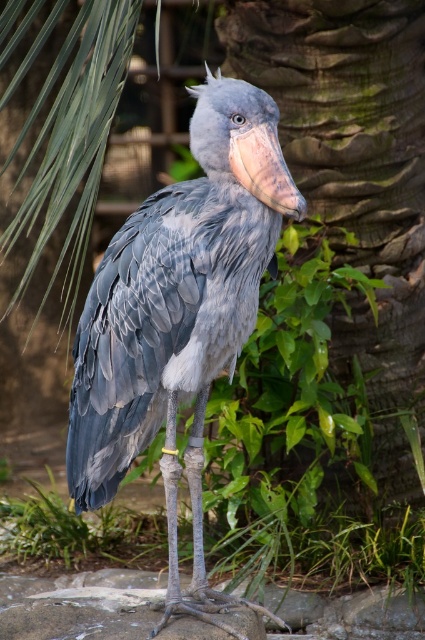
Question: Can you confirm if gray matte bird at center is smaller than rough bark tree trunk at center?

Choices:
 (A) yes
 (B) no

Answer: (A)

Question: Which object is closer to the camera taking this photo?

Choices:
 (A) gray matte bird at center
 (B) rough bark tree trunk at center

Answer: (A)

Question: Which point is farther to the camera?

Choices:
 (A) (305, 3)
 (B) (193, 198)

Answer: (A)

Question: Which point is farther from the camera taking this photo?

Choices:
 (A) (249, 196)
 (B) (419, 102)

Answer: (B)

Question: Does gray matte bird at center appear over rough bark tree trunk at center?

Choices:
 (A) yes
 (B) no

Answer: (B)

Question: Is gray matte bird at center further to the viewer compared to rough bark tree trunk at center?

Choices:
 (A) no
 (B) yes

Answer: (A)